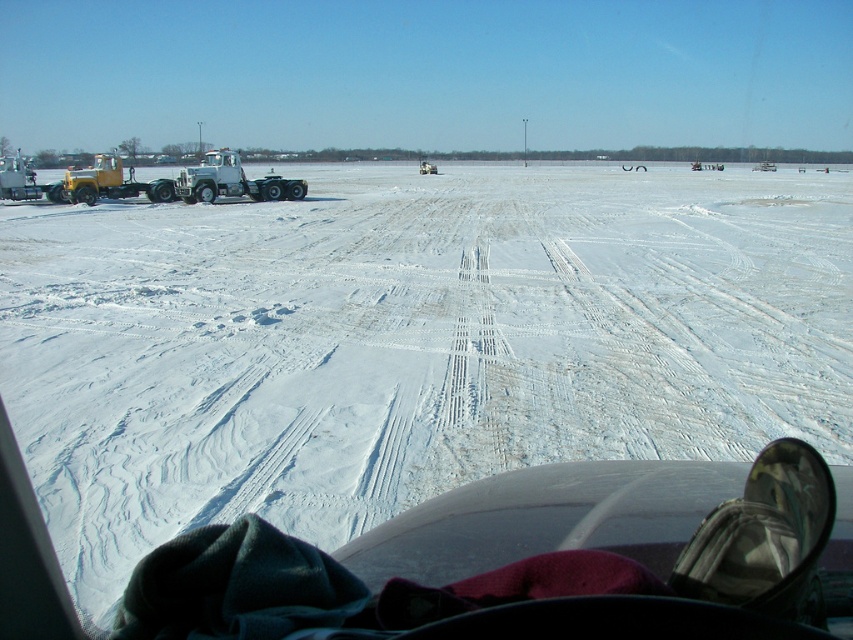
Can you confirm if white powdery snow at center is positioned below white matte trailer truck at left?

Correct, white powdery snow at center is located below white matte trailer truck at left.

Can you confirm if white powdery snow at center is shorter than white matte trailer truck at left?

In fact, white powdery snow at center may be taller than white matte trailer truck at left.

Image resolution: width=853 pixels, height=640 pixels. Describe the element at coordinates (409, 340) in the screenshot. I see `white powdery snow at center` at that location.

Where is `white powdery snow at center`? white powdery snow at center is located at coordinates (409, 340).